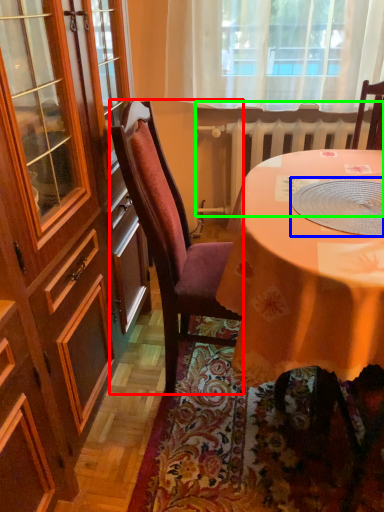
Question: Which is nearer to the chair (highlighted by a red box)? tableware (highlighted by a blue box) or radiator (highlighted by a green box).

Choices:
 (A) tableware
 (B) radiator

Answer: (A)